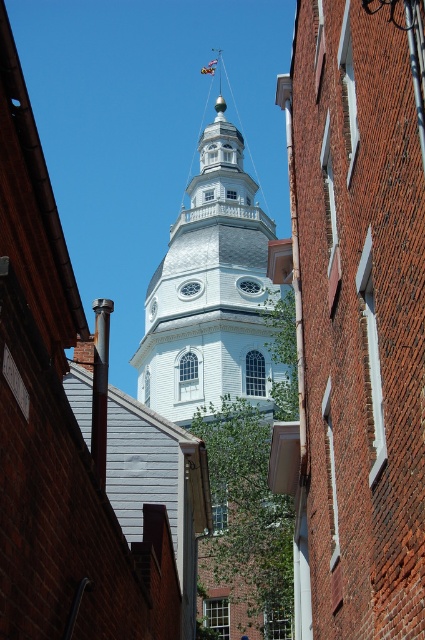
Does brick church at center come behind white textured dome at center?

That is False.

Does point (393, 369) come in front of point (170, 380)?

That is True.

Who is more forward, (370, 438) or (217, 236)?

Positioned in front is point (370, 438).

You are a GUI agent. You are given a task and a screenshot of the screen. Output one action in this format:
    pyautogui.click(x=<x>, y=<y>)
    Task: Click on the brick church at center
    
    Given the screenshot: What is the action you would take?
    [x=357, y=314]

Which is in front, point (227, 317) or point (206, 72)?

Point (227, 317)

Locate an element on the screen. The image size is (425, 640). white textured dome at center is located at coordinates pyautogui.click(x=209, y=291).

From the picture: Who is higher up, brick church at center or blue fabric flag at upper center?

Positioned higher is blue fabric flag at upper center.

Between brick church at center and blue fabric flag at upper center, which one has more height?

brick church at center

Describe the element at coordinates (357, 314) in the screenshot. I see `brick church at center` at that location.

At what (x,y) coordinates should I click in order to perform the action: click on brick church at center. Please return your answer as a coordinate pair (x, y). Image resolution: width=425 pixels, height=640 pixels. Looking at the image, I should click on (357, 314).